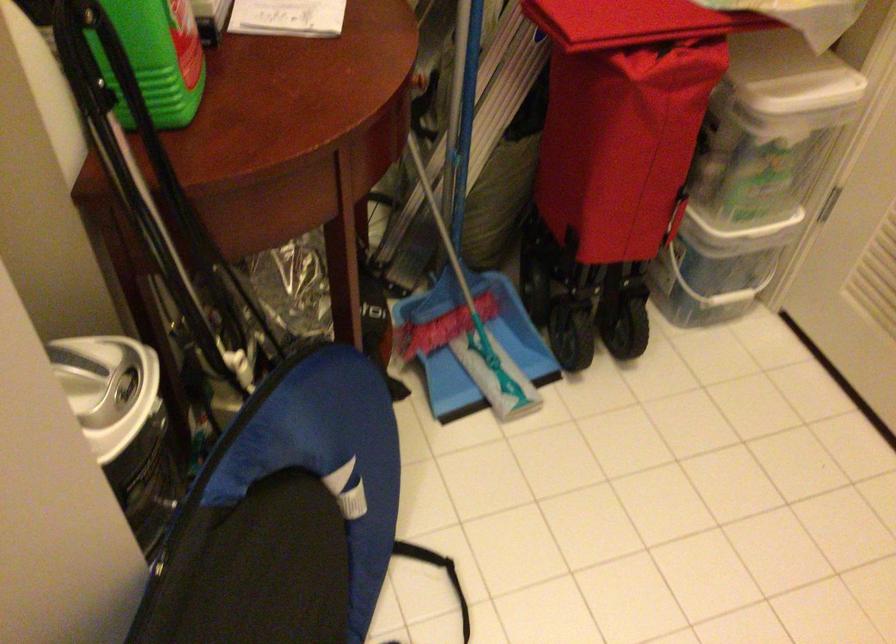
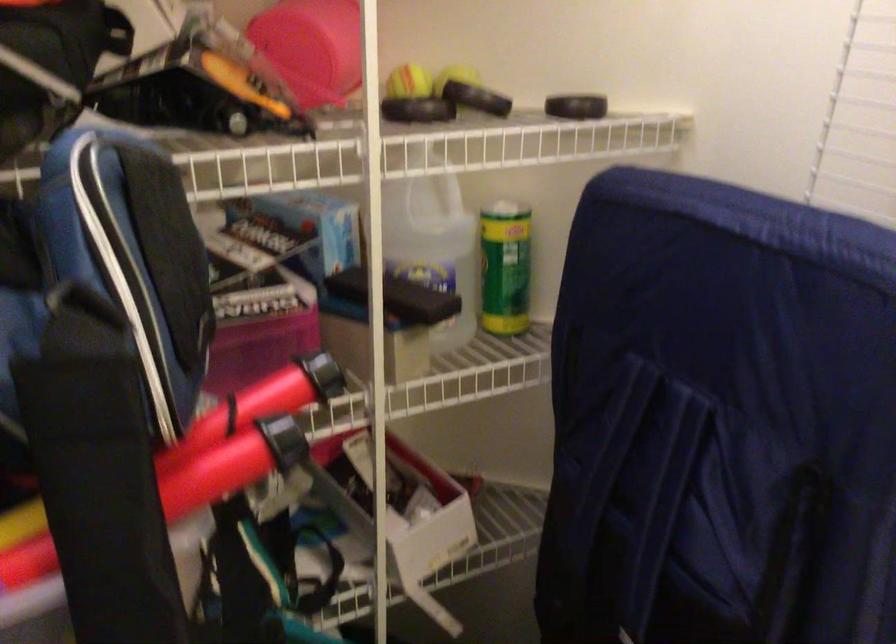
Question: The first image is from the beginning of the video and the second image is from the end. How did the camera likely rotate when shooting the video?

Choices:
 (A) Left
 (B) Right
 (C) Up
 (D) Down

Answer: (A)